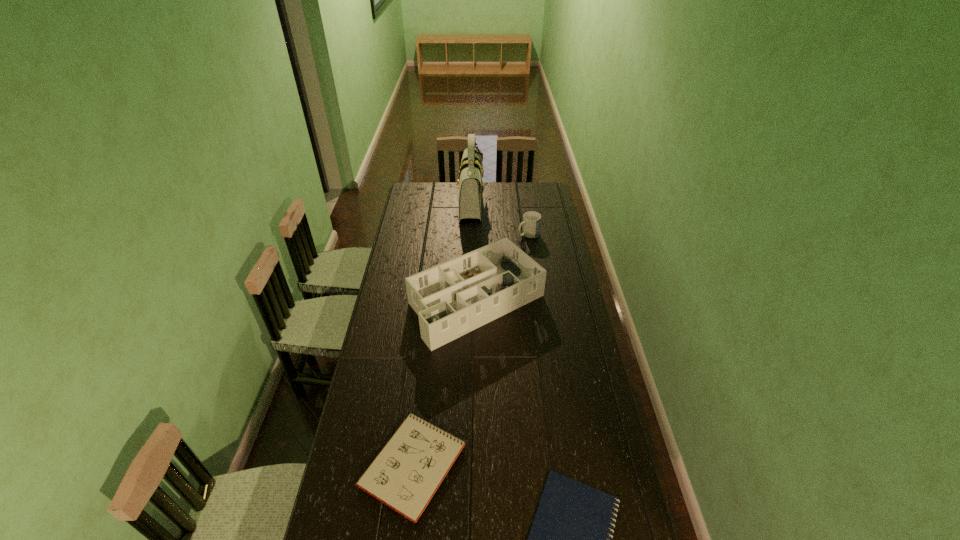
This screenshot has width=960, height=540. What are the coordinates of `blank space located on the right of the second farthest object` in the screenshot? It's located at (552, 234).

This screenshot has height=540, width=960. Identify the location of free space located 0.390m on the right of the fourth tallest object. click(586, 464).

You are a GUI agent. You are given a task and a screenshot of the screen. Output one action in this format:
    pyautogui.click(x=<x>, y=<y>)
    Task: Click on the object that is at the far edge
    The image size is (960, 540).
    Given the screenshot: What is the action you would take?
    pyautogui.click(x=471, y=187)

I want to click on dollhouse located in the left edge section of the desktop, so click(x=451, y=299).

Where is `notepad that is positioned at the left edge`? The height and width of the screenshot is (540, 960). notepad that is positioned at the left edge is located at coordinates (405, 475).

The height and width of the screenshot is (540, 960). Find the location of `dollhouse present at the right edge`. dollhouse present at the right edge is located at coordinates (451, 299).

Locate an element on the screen. The height and width of the screenshot is (540, 960). mug present at the right edge is located at coordinates (531, 220).

The width and height of the screenshot is (960, 540). In the image, there is a desktop. Find the location of `vacant space at the far edge`. vacant space at the far edge is located at coordinates (440, 198).

Identify the location of free region at the left edge of the desktop. This screenshot has width=960, height=540. (404, 307).

Locate an element on the screen. This screenshot has height=540, width=960. free space at the right edge is located at coordinates (555, 233).